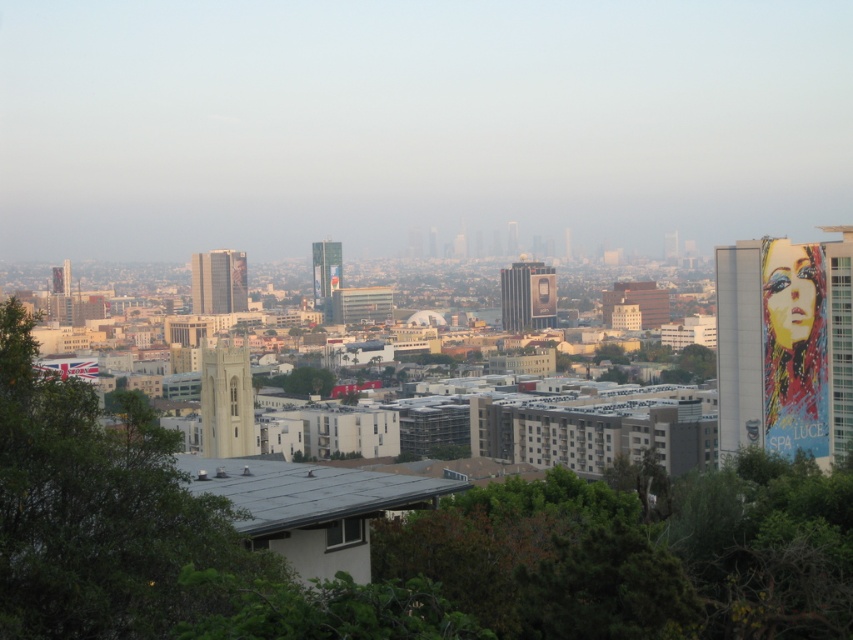
You are standing at the base of the green leafy tree at left and want to walk to a friend who is exactly 1 kilometer away from the tree. Can you reach your friend without walking more than 1 kilometer?

The distance between the green leafy tree at left and the viewer is 651.24 meters. Since your friend is exactly 1 kilometer away from the tree, you would need to walk 1 kilometer to reach them, which is within the 651.24 meter limit. Wait, actually, the viewer is 651.24 meters from the tree. If the friend is 1 km away from the tree, the maximum distance between you and your friend would be 651.24m plus 1000m, but that might not be the case. Hmm, perhaps the question is whether the friend is in the same line

Looking at this image, you are a photographer planning to capture a cityscape with the green leafy tree at left and the matte glass skyscraper at center in the same frame. Based on their sizes in the image, which object would appear more dominant in the composition?

The green leafy tree at left would appear more dominant in the composition because it has a larger size compared to the matte glass skyscraper at center.

You are standing at the point with coordinates point (164, 449) and want to walk towards point (236, 289). Which direction should you move in order to get closer to your destination?

Since point (164, 449) is further to the viewer than point (236, 289), you should move forward towards the direction of the background to get closer to point (236, 289).